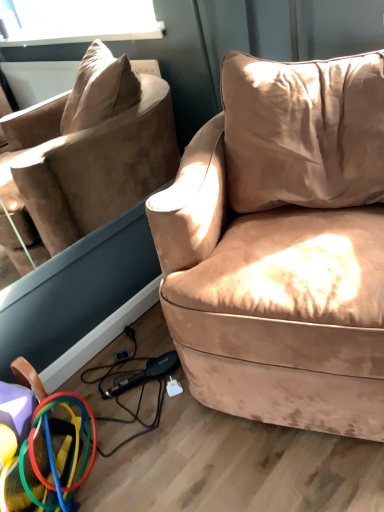
Question: Considering the relative positions of suede-like beige couch at center-right and rubberized plastic rings at lower left in the image provided, is suede-like beige couch at center-right to the left of rubberized plastic rings at lower left from the viewer's perspective?

Choices:
 (A) no
 (B) yes

Answer: (A)

Question: Is suede-like beige couch at center-right aimed at rubberized plastic rings at lower left?

Choices:
 (A) no
 (B) yes

Answer: (A)

Question: Can you confirm if suede-like beige couch at center-right is bigger than rubberized plastic rings at lower left?

Choices:
 (A) yes
 (B) no

Answer: (A)

Question: Does suede-like beige couch at center-right have a greater width compared to rubberized plastic rings at lower left?

Choices:
 (A) no
 (B) yes

Answer: (B)

Question: From a real-world perspective, is suede-like beige couch at center-right located beneath rubberized plastic rings at lower left?

Choices:
 (A) yes
 (B) no

Answer: (B)

Question: Is rubberized plastic rings at lower left a part of suede-like beige couch at center-right?

Choices:
 (A) no
 (B) yes

Answer: (A)

Question: Is beige velvet pillow at upper right at the right side of suede-like beige couch at center-right?

Choices:
 (A) yes
 (B) no

Answer: (A)

Question: Is beige velvet pillow at upper right further to the viewer compared to suede-like beige couch at center-right?

Choices:
 (A) no
 (B) yes

Answer: (B)

Question: Is beige velvet pillow at upper right outside of suede-like beige couch at center-right?

Choices:
 (A) yes
 (B) no

Answer: (A)

Question: From the image's perspective, would you say beige velvet pillow at upper right is positioned over suede-like beige couch at center-right?

Choices:
 (A) no
 (B) yes

Answer: (B)

Question: Is the position of beige velvet pillow at upper right less distant than that of suede-like beige couch at center-right?

Choices:
 (A) yes
 (B) no

Answer: (B)

Question: Can you confirm if beige velvet pillow at upper right is smaller than suede-like beige couch at center-right?

Choices:
 (A) yes
 (B) no

Answer: (A)

Question: Is the position of beige velvet pillow at upper right less distant than that of rubberized plastic rings at lower left?

Choices:
 (A) no
 (B) yes

Answer: (A)